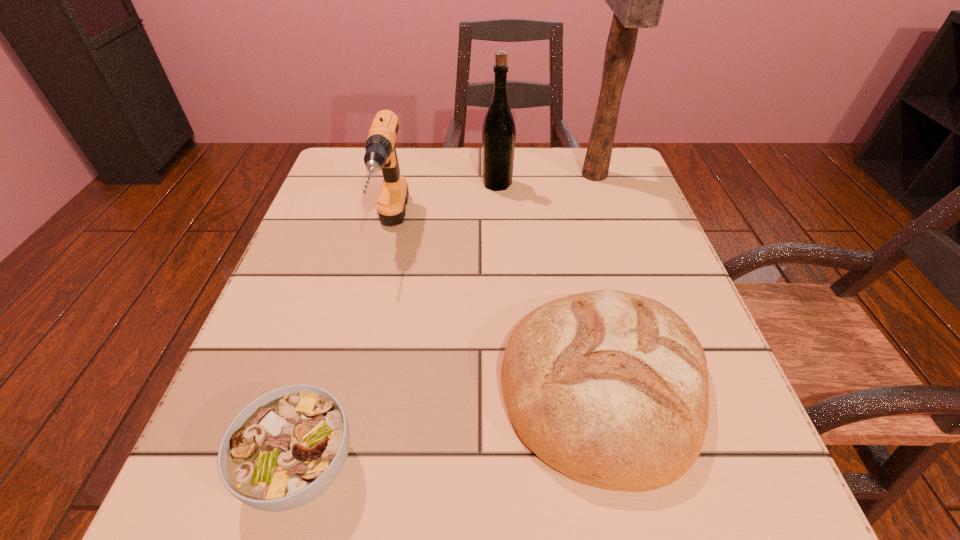
Identify the location of object located in the near left corner section of the desktop. This screenshot has height=540, width=960. click(x=286, y=448).

Find the location of `object positioned at the far right corner`. object positioned at the far right corner is located at coordinates (637, 0).

I want to click on object present at the near right corner, so click(x=610, y=388).

Locate an element on the screen. This screenshot has width=960, height=540. blank area at the far edge is located at coordinates (540, 189).

You are a GUI agent. You are given a task and a screenshot of the screen. Output one action in this format:
    pyautogui.click(x=<x>, y=<y>)
    Task: Click on the free space at the near edge of the desktop
    The height and width of the screenshot is (540, 960).
    Given the screenshot: What is the action you would take?
    pyautogui.click(x=342, y=510)

You are a GUI agent. You are given a task and a screenshot of the screen. Output one action in this format:
    pyautogui.click(x=<x>, y=<y>)
    Task: Click on the vacant space at the left edge of the desktop
    
    Given the screenshot: What is the action you would take?
    pyautogui.click(x=345, y=307)

At what (x,y) coordinates should I click in order to perform the action: click on vacant space at the right edge. Please return your answer as a coordinate pair (x, y). Looking at the image, I should click on (739, 434).

This screenshot has height=540, width=960. In the image, there is a desktop. In order to click on vacant space at the far left corner in this screenshot , I will do `click(349, 187)`.

Find the location of a particular element. free space at the near right corner of the desktop is located at coordinates (694, 464).

Locate an element on the screen. The image size is (960, 540). free area in between the shortest object and the third tallest object is located at coordinates (347, 348).